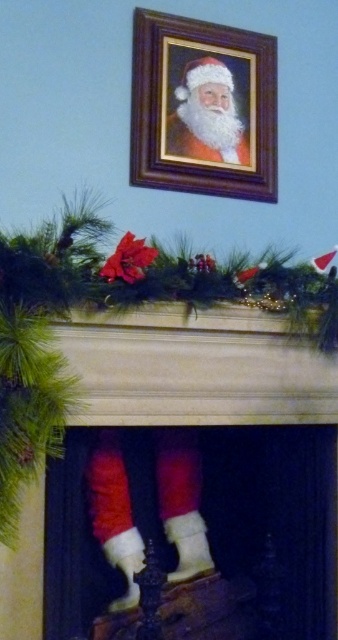
Question: Is gold/wooden picture frame at upper center bigger than white fluffy santa at upper center?

Choices:
 (A) yes
 (B) no

Answer: (A)

Question: Which point is closer to the camera?

Choices:
 (A) white fluffy santa at upper center
 (B) velvet red stocking at lower center

Answer: (B)

Question: Which point is farther from the camera taking this photo?

Choices:
 (A) (174, 124)
 (B) (210, 22)
 (C) (239, 404)

Answer: (B)

Question: Is velvet red stocking at lower center above gold/wooden picture frame at upper center?

Choices:
 (A) yes
 (B) no

Answer: (B)

Question: Among these objects, which one is nearest to the camera?

Choices:
 (A) white fluffy santa at upper center
 (B) velvet red stocking at lower center
 (C) gold/wooden picture frame at upper center

Answer: (B)

Question: Is the position of gold/wooden picture frame at upper center more distant than that of white fluffy santa at upper center?

Choices:
 (A) yes
 (B) no

Answer: (B)